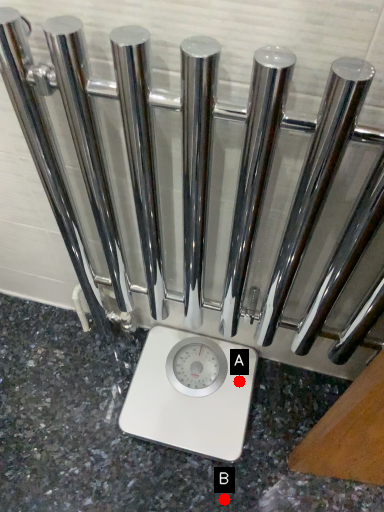
Question: Two points are circled on the image, labeled by A and B beside each circle. Which point is closer to the camera taking this photo?

Choices:
 (A) A is closer
 (B) B is closer

Answer: (B)